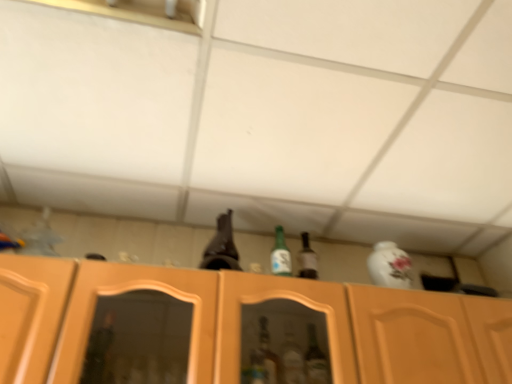
What do you see at coordinates (280, 255) in the screenshot?
I see `green glass bottle at center` at bounding box center [280, 255].

What is the approximate height of green glass bottle at center?

8.92 inches.

What do you see at coordinates (240, 323) in the screenshot?
I see `wooden cabinet at center` at bounding box center [240, 323].

Image resolution: width=512 pixels, height=384 pixels. In order to click on brown glass beer bottle at upper center in this screenshot , I will do `click(222, 247)`.

The height and width of the screenshot is (384, 512). In order to click on beer bottle above the wooden cabinet at center (from a real-world perspective) in this screenshot , I will do `click(222, 247)`.

Considering the relative sizes of brown glass beer bottle at upper center and wooden cabinet at center in the image provided, is brown glass beer bottle at upper center shorter than wooden cabinet at center?

Yes.

Is brown glass beer bottle at upper center behind wooden cabinet at center?

Yes, brown glass beer bottle at upper center is further from the viewer.

Is brown glass beer bottle at upper center bigger than wooden cabinet at center?

Incorrect, brown glass beer bottle at upper center is not larger than wooden cabinet at center.

Considering the relative sizes of brown glass beer bottle at upper center and green glass bottle at center in the image provided, is brown glass beer bottle at upper center wider than green glass bottle at center?

Indeed, brown glass beer bottle at upper center has a greater width compared to green glass bottle at center.

Is brown glass beer bottle at upper center in front of green glass bottle at center?

That is True.

From the image's perspective, is brown glass beer bottle at upper center located above or below green glass bottle at center?

Based on their image positions, brown glass beer bottle at upper center is located above green glass bottle at center.

From a real-world perspective, is brown glass beer bottle at upper center on top of green glass bottle at center?

Yes.

Is green glass bottle at center touching brown glass beer bottle at upper center?

No, green glass bottle at center is not beside brown glass beer bottle at upper center.

Is green glass bottle at center positioned with its back to brown glass beer bottle at upper center?

No, green glass bottle at center is not facing away from brown glass beer bottle at upper center.

Can you confirm if green glass bottle at center is taller than brown glass beer bottle at upper center?

No.

What are the coordinates of `bottle on the right of brown glass beer bottle at upper center` in the screenshot? It's located at (280, 255).

Between green glass bottle at center and wooden cabinet at center, which one has smaller size?

green glass bottle at center is smaller.

I want to click on cabinetry directly beneath the green glass bottle at center (from a real-world perspective), so click(240, 323).

From a real-world perspective, is green glass bottle at center located higher than wooden cabinet at center?

→ Yes, from a real-world perspective, green glass bottle at center is above wooden cabinet at center.

Could you tell me if wooden cabinet at center is turned towards brown glass beer bottle at upper center?

No, wooden cabinet at center is not aimed at brown glass beer bottle at upper center.

Find the location of a particular element. This screenshot has height=384, width=512. beer bottle on the left of wooden cabinet at center is located at coordinates (222, 247).

Can you tell me how much wooden cabinet at center and brown glass beer bottle at upper center differ in facing direction?

They differ by 6.63 degrees in their facing directions.

Is wooden cabinet at center shorter than brown glass beer bottle at upper center?

In fact, wooden cabinet at center may be taller than brown glass beer bottle at upper center.

Are wooden cabinet at center and green glass bottle at center located far from each other?

wooden cabinet at center is near green glass bottle at center, not far away.

Would you say wooden cabinet at center is inside or outside green glass bottle at center?

wooden cabinet at center is located beyond the bounds of green glass bottle at center.

Considering the positions of objects wooden cabinet at center and green glass bottle at center in the image provided, who is in front, wooden cabinet at center or green glass bottle at center?

wooden cabinet at center is more forward.

Could you tell me if wooden cabinet at center is turned towards green glass bottle at center?

No, wooden cabinet at center is not aimed at green glass bottle at center.

Where is `beer bottle above the wooden cabinet at center (from the image's perspective)`? beer bottle above the wooden cabinet at center (from the image's perspective) is located at coordinates (222, 247).

The height and width of the screenshot is (384, 512). I want to click on bottle directly beneath the brown glass beer bottle at upper center (from a real-world perspective), so pyautogui.click(x=280, y=255).

When comparing their distances from brown glass beer bottle at upper center, does wooden cabinet at center or green glass bottle at center seem further?

wooden cabinet at center.

Based on their spatial positions, is green glass bottle at center or wooden cabinet at center further from brown glass beer bottle at upper center?

Among the two, wooden cabinet at center is located further to brown glass beer bottle at upper center.

Looking at the image, which one is located closer to green glass bottle at center, wooden cabinet at center or brown glass beer bottle at upper center?

The object closer to green glass bottle at center is brown glass beer bottle at upper center.

Considering their positions, is green glass bottle at center positioned further to wooden cabinet at center than brown glass beer bottle at upper center?

green glass bottle at center is further to wooden cabinet at center.

Based on the photo, based on their spatial positions, is brown glass beer bottle at upper center or wooden cabinet at center further from green glass bottle at center?

The object further to green glass bottle at center is wooden cabinet at center.

Which object lies further to the anchor point wooden cabinet at center, brown glass beer bottle at upper center or green glass bottle at center?

Based on the image, green glass bottle at center appears to be further to wooden cabinet at center.

Image resolution: width=512 pixels, height=384 pixels. In order to click on beer bottle positioned between wooden cabinet at center and green glass bottle at center from near to far in this screenshot , I will do [x=222, y=247].